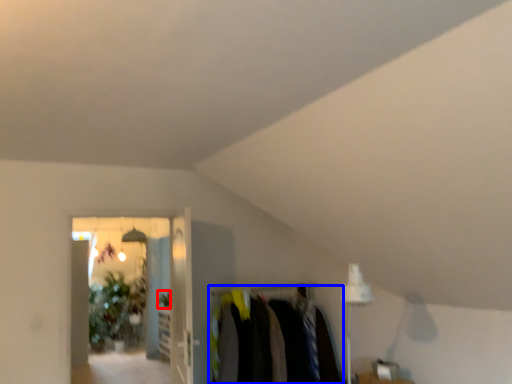
Question: Which point is further to the camera, plant (highlighted by a red box) or closet (highlighted by a blue box)?

Choices:
 (A) plant
 (B) closet

Answer: (A)